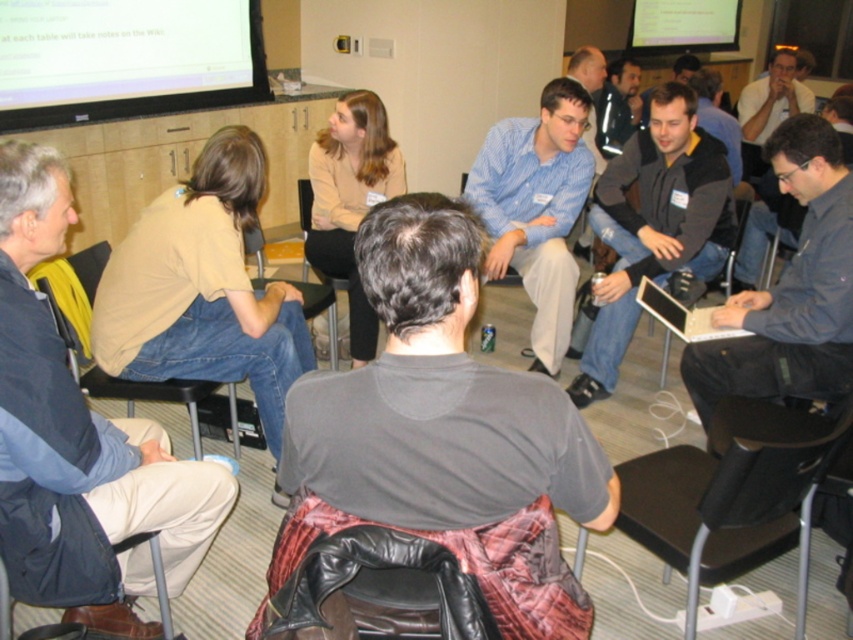
You are an attendee in the room and want to take a photo of both the matte black projector screen at upper left and the white glossy projector screen at upper center. Which one should you aim your camera towards first if you want to capture both in a single frame without moving your camera?

You should aim your camera towards the matte black projector screen at upper left first since it is positioned to the left of the white glossy projector screen at upper center, allowing both screens to be captured in a single frame without moving the camera.